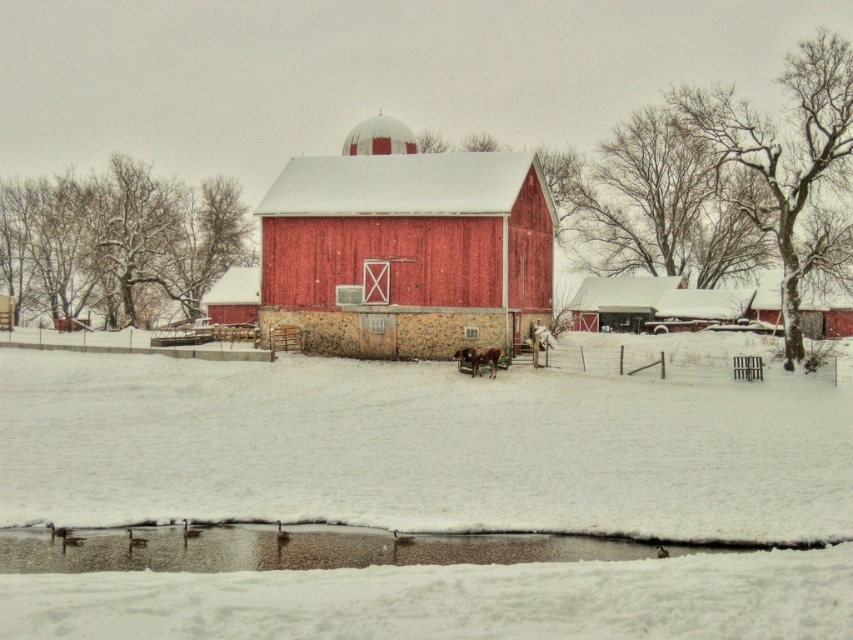
Question: Is matte wood barn at center wider than brown fuzzy cow at center?

Choices:
 (A) yes
 (B) no

Answer: (A)

Question: Which of the following is the farthest from the observer?

Choices:
 (A) (383, 173)
 (B) (498, 348)
 (C) (193, 387)
 (D) (477, 536)

Answer: (A)

Question: Among these objects, which one is farthest from the camera?

Choices:
 (A) brown fuzzy cow at center
 (B) matte wood barn at center
 (C) brown muddy puddle at lower center

Answer: (B)

Question: Can you confirm if white fluffy snow at center is thinner than brown muddy puddle at lower center?

Choices:
 (A) no
 (B) yes

Answer: (A)

Question: Does matte wood barn at center have a lesser width compared to brown fuzzy cow at center?

Choices:
 (A) no
 (B) yes

Answer: (A)

Question: Which is nearer to the white fluffy snow at center?

Choices:
 (A) brown muddy puddle at lower center
 (B) matte wood barn at center
 (C) brown fuzzy cow at center

Answer: (A)